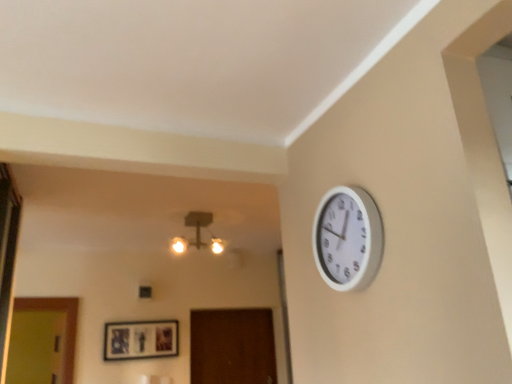
Question: Considering the relative positions of matte black picture frame at center and white plastic wall clock at upper right in the image provided, is matte black picture frame at center to the left or to the right of white plastic wall clock at upper right?

Choices:
 (A) left
 (B) right

Answer: (A)

Question: Considering their positions, is matte black picture frame at center located in front of or behind white plastic wall clock at upper right?

Choices:
 (A) front
 (B) behind

Answer: (B)

Question: Which object is the farthest from the matte glass chandelier at upper center?

Choices:
 (A) matte black picture frame at center
 (B) white plastic wall clock at upper right

Answer: (B)

Question: Estimate the real-world distances between objects in this image. Which object is closer to the matte glass chandelier at upper center?

Choices:
 (A) white plastic wall clock at upper right
 (B) matte black picture frame at center

Answer: (B)